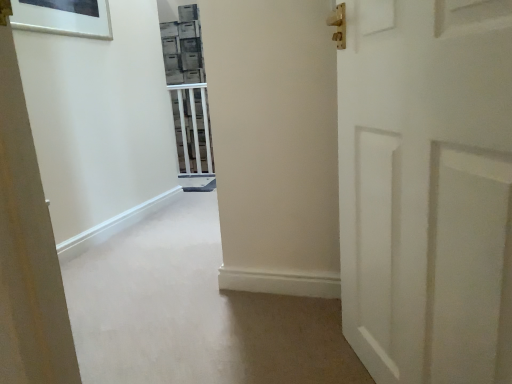
This screenshot has height=384, width=512. What do you see at coordinates (426, 189) in the screenshot? I see `white matte door at right` at bounding box center [426, 189].

Image resolution: width=512 pixels, height=384 pixels. Find the location of `white matte door at right`. white matte door at right is located at coordinates [x=426, y=189].

At what (x,y) coordinates should I click in order to perform the action: click on white matte door at right. Please return your answer as a coordinate pair (x, y). Looking at the image, I should click on click(426, 189).